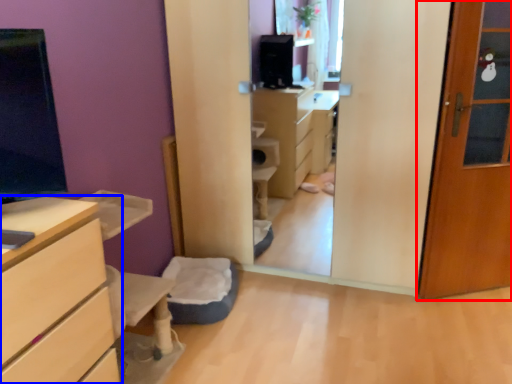
Question: Among these objects, which one is nearest to the camera, door (highlighted by a red box) or chest of drawers (highlighted by a blue box)?

Choices:
 (A) door
 (B) chest of drawers

Answer: (B)